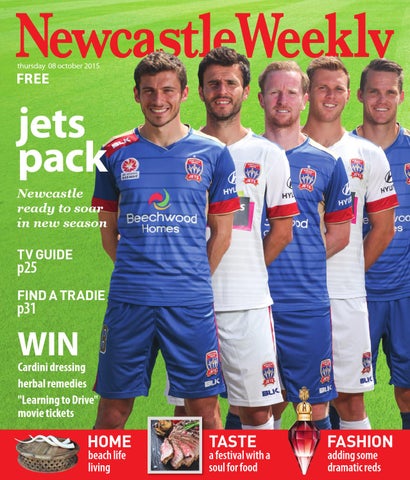
The image size is (410, 480). I want to click on basket, so click(x=54, y=458).